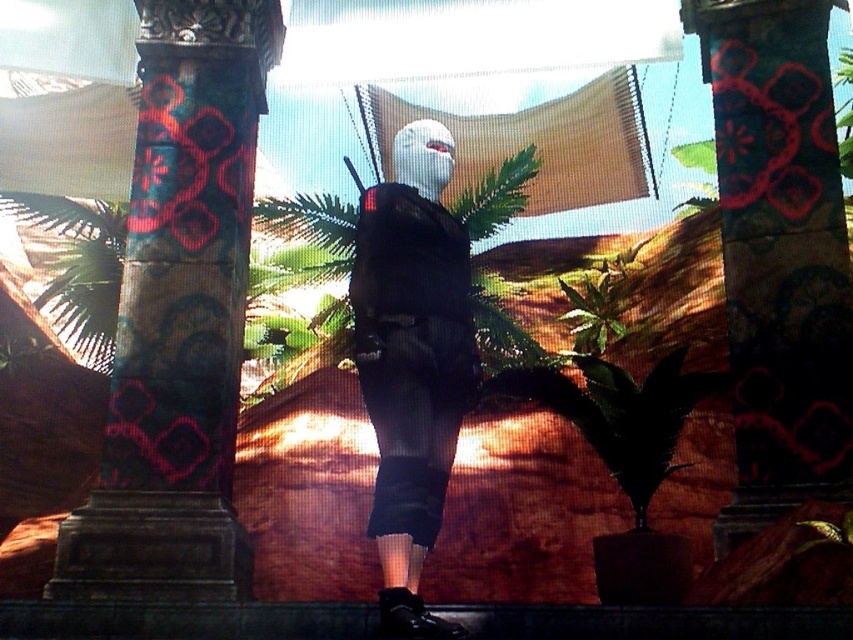
Is carved stone column at center behind matte black backpack at center?

Yes, it is.

Does carved stone column at center have a larger size compared to matte black backpack at center?

Indeed, carved stone column at center has a larger size compared to matte black backpack at center.

Is point (844, 230) in front of point (419, 525)?

No, (844, 230) is further to viewer.

I want to click on carved stone column at center, so click(x=779, y=253).

Who is shorter, carved stone column at left or carved stone column at center?

carved stone column at center

Between carved stone column at left and carved stone column at center, which one has more height?

carved stone column at left

At what (x,y) coordinates should I click in order to perform the action: click on carved stone column at left. Please return your answer as a coordinate pair (x, y). The height and width of the screenshot is (640, 853). Looking at the image, I should click on (178, 316).

Where is `carved stone column at left`? The height and width of the screenshot is (640, 853). carved stone column at left is located at coordinates (178, 316).

Is carved stone column at left thinner than matte black backpack at center?

In fact, carved stone column at left might be wider than matte black backpack at center.

Is carved stone column at left below matte black backpack at center?

Actually, carved stone column at left is above matte black backpack at center.

Between point (136, 372) and point (369, 356), which one is positioned in front?

Point (369, 356) is more forward.

I want to click on carved stone column at left, so click(178, 316).